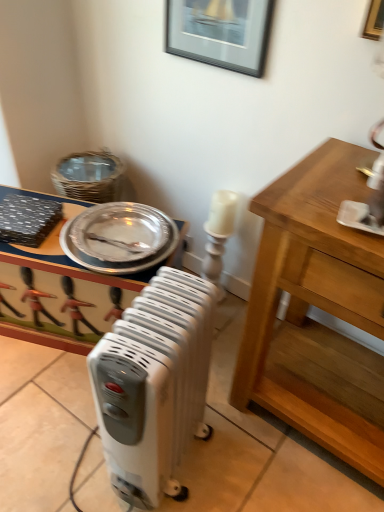
Question: Can you confirm if metallic silver tray at center is taller than black glossy picture frame at upper center?

Choices:
 (A) yes
 (B) no

Answer: (A)

Question: From the image's perspective, is metallic silver tray at center located beneath black glossy picture frame at upper center?

Choices:
 (A) yes
 (B) no

Answer: (A)

Question: Could you tell me if metallic silver tray at center is facing black glossy picture frame at upper center?

Choices:
 (A) yes
 (B) no

Answer: (B)

Question: Does metallic silver tray at center lie behind black glossy picture frame at upper center?

Choices:
 (A) no
 (B) yes

Answer: (B)

Question: Does metallic silver tray at center touch black glossy picture frame at upper center?

Choices:
 (A) yes
 (B) no

Answer: (B)

Question: Can you confirm if metallic silver tray at center is positioned to the right of black glossy picture frame at upper center?

Choices:
 (A) no
 (B) yes

Answer: (A)

Question: Does black glossy picture frame at upper center have a larger size compared to metallic silver tray at center?

Choices:
 (A) yes
 (B) no

Answer: (B)

Question: From a real-world perspective, is black glossy picture frame at upper center on top of metallic silver tray at center?

Choices:
 (A) yes
 (B) no

Answer: (A)

Question: Is black glossy picture frame at upper center placed right next to metallic silver tray at center?

Choices:
 (A) no
 (B) yes

Answer: (A)

Question: Is metallic silver tray at center inside black glossy picture frame at upper center?

Choices:
 (A) yes
 (B) no

Answer: (B)

Question: Could you tell me if black glossy picture frame at upper center is turned towards metallic silver tray at center?

Choices:
 (A) no
 (B) yes

Answer: (A)

Question: Does black glossy picture frame at upper center have a lesser width compared to metallic silver tray at center?

Choices:
 (A) yes
 (B) no

Answer: (A)

Question: From the image's perspective, is silver metallic platter at upper left below white plastic radiator at center?

Choices:
 (A) no
 (B) yes

Answer: (A)